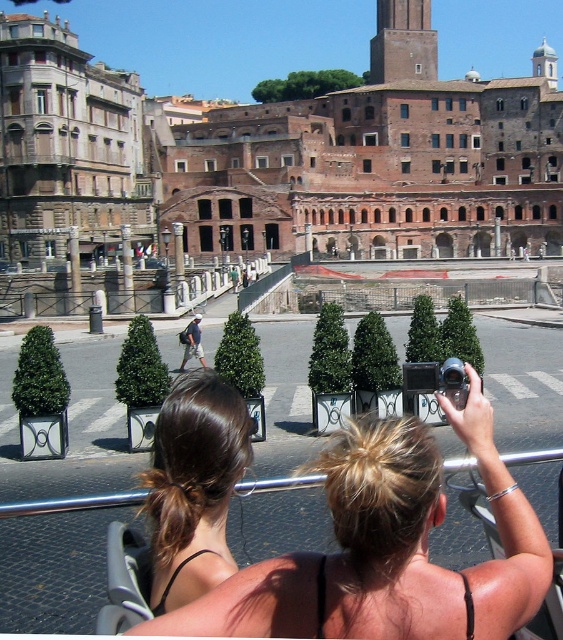
Question: Which point is farther to the camera?

Choices:
 (A) (198, 323)
 (B) (374, 561)
 (C) (342, 234)
 (D) (167, 496)

Answer: (C)

Question: Is reddish-brown stone amphitheater at center further to camera compared to denim shorts at center?

Choices:
 (A) yes
 (B) no

Answer: (A)

Question: Which is nearer to the reddish-brown stone amphitheater at center?

Choices:
 (A) denim shorts at center
 (B) blonde hair at upper center

Answer: (A)

Question: Which point appears farthest from the camera in this image?

Choices:
 (A) click(x=196, y=342)
 (B) click(x=283, y=608)

Answer: (A)

Question: Is blonde hair at upper center bigger than denim shorts at center?

Choices:
 (A) yes
 (B) no

Answer: (A)

Question: Does blonde hair at upper center have a greater width compared to brown hair at center?

Choices:
 (A) yes
 (B) no

Answer: (A)